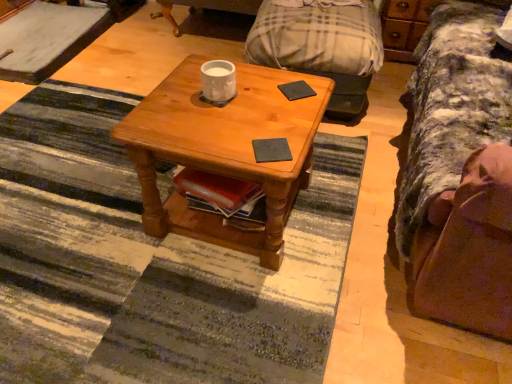
Locate an element on the screen. vacant space that is to the left of white glossy mug at center is located at coordinates (170, 96).